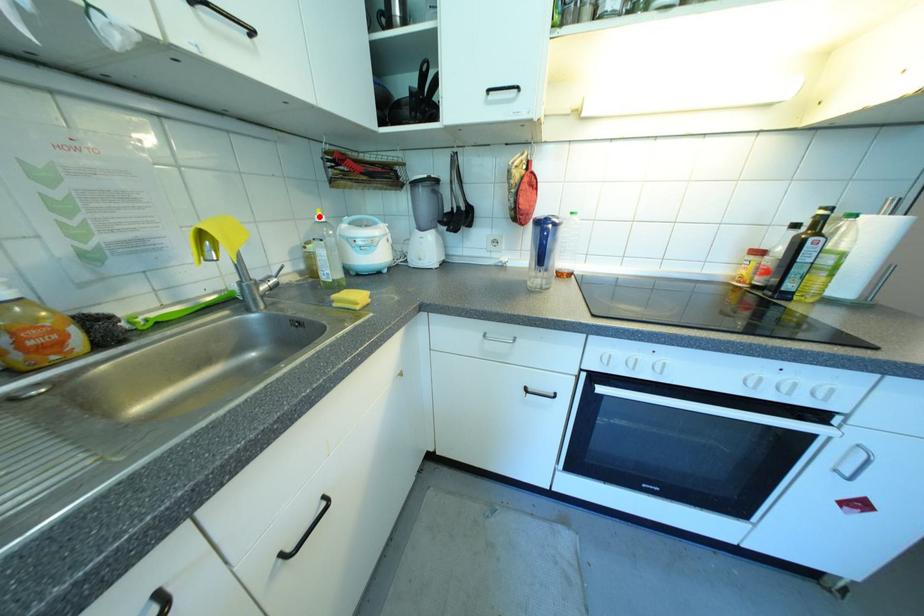
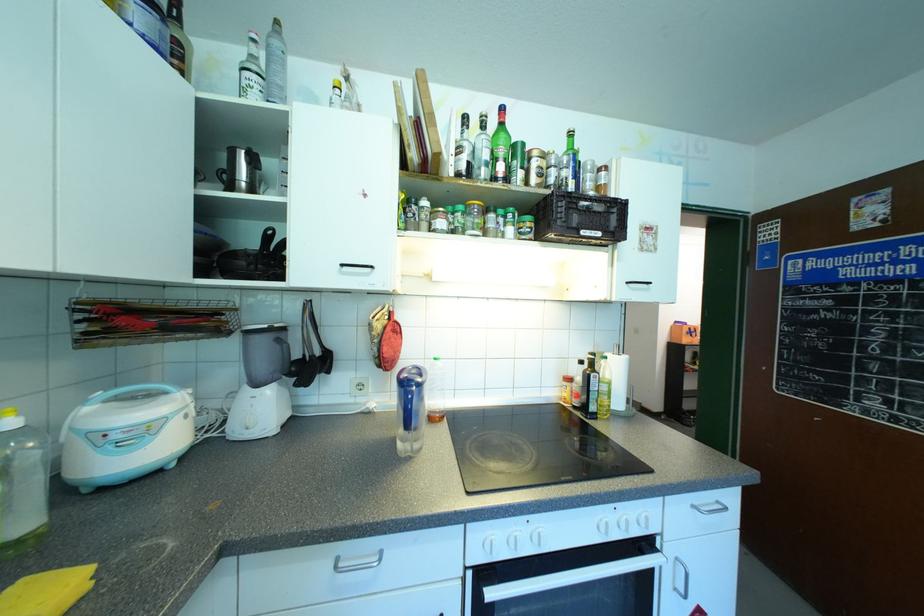
Locate, in the second image, the point that corresponds to the highlighted location in the first image.

(8, 422)